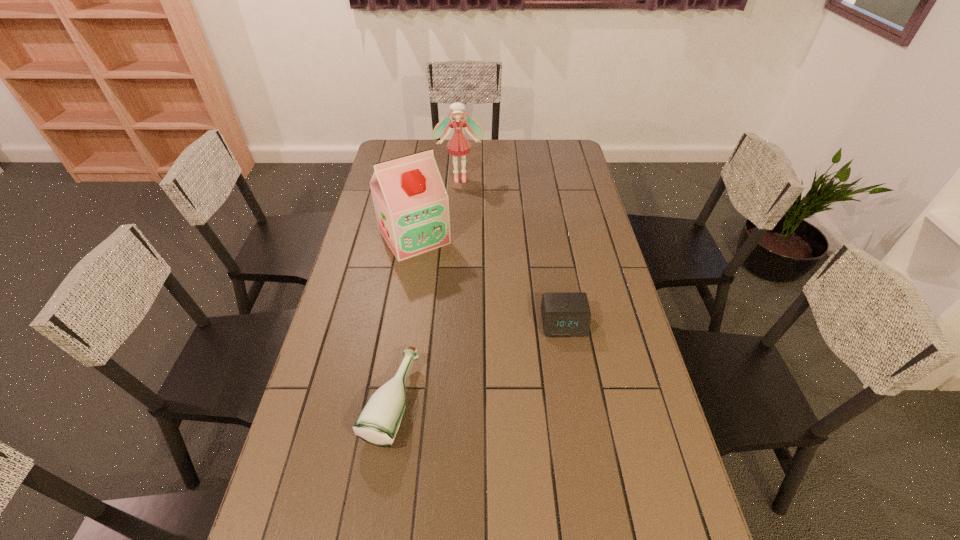
Identify the location of free region located 0.230m on the front-facing side of the farthest object. (465, 218).

Where is `vacant space situated on the front-facing side of the farthest object`? vacant space situated on the front-facing side of the farthest object is located at coordinates (463, 202).

Find the location of `vacant area located on the front-facing side of the farthest object`. vacant area located on the front-facing side of the farthest object is located at coordinates (463, 200).

The width and height of the screenshot is (960, 540). Identify the location of bottle that is at the left edge. (x=378, y=423).

I want to click on soya milk located at the left edge, so click(x=411, y=203).

This screenshot has height=540, width=960. I want to click on object situated at the right edge, so click(564, 314).

Locate an element on the screen. This screenshot has height=540, width=960. vacant space at the far edge of the desktop is located at coordinates (499, 152).

This screenshot has width=960, height=540. Find the location of `vacant space at the near edge`. vacant space at the near edge is located at coordinates (587, 525).

Identify the location of vacant region at the left edge of the desktop. (355, 285).

In order to click on vacant region at the right edge of the desktop in this screenshot , I will do `click(590, 241)`.